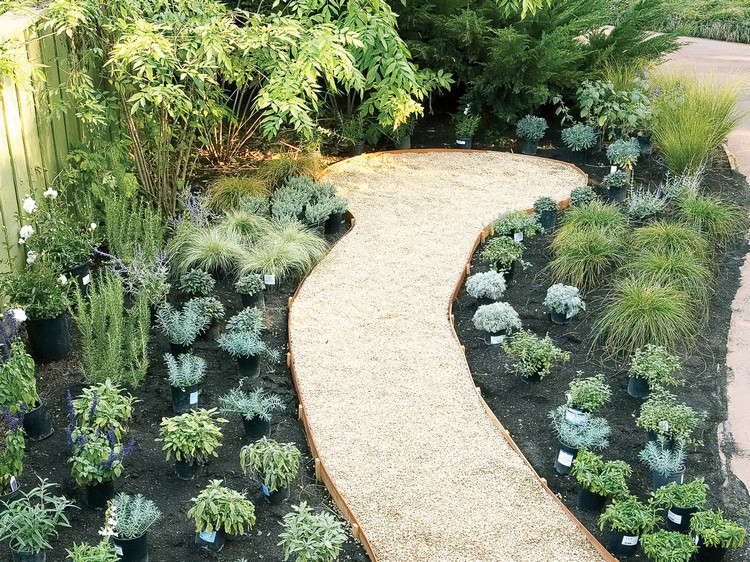
This screenshot has height=562, width=750. In order to click on small plants in this screenshot , I will do `click(574, 448)`.